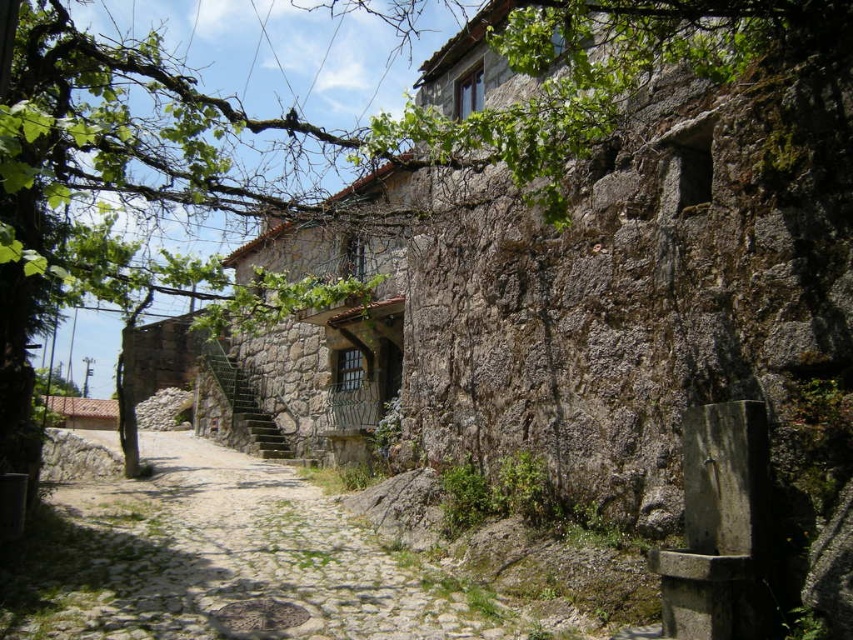
Who is more forward, (189, 538) or (213, 371)?

Point (189, 538) is in front.

Between cobblestone path at center and rustic stone stairs at center, which one appears on the right side from the viewer's perspective?

cobblestone path at center

Is point (103, 582) behind point (262, 413)?

No.

Find the location of a particular element. cobblestone path at center is located at coordinates (231, 561).